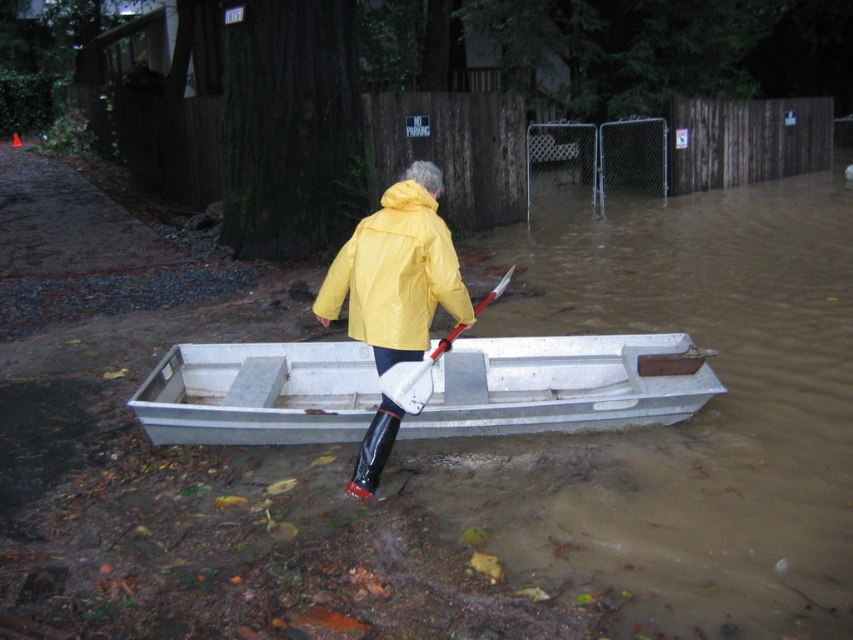
Is metallic gray boat at center bigger than white plastic paddle at center?

Yes.

Does metallic gray boat at center appear under white plastic paddle at center?

Yes, metallic gray boat at center is below white plastic paddle at center.

Who is more distant from viewer, (x=473, y=365) or (x=401, y=385)?

The point (x=473, y=365) is more distant.

Identify the location of metallic gray boat at center. The width and height of the screenshot is (853, 640). [x=561, y=385].

Can you confirm if metallic gray boat at center is positioned above yellow matte jacket at center?

Actually, metallic gray boat at center is below yellow matte jacket at center.

Is point (686, 381) in front of point (402, 332)?

No, (686, 381) is behind (402, 332).

Image resolution: width=853 pixels, height=640 pixels. I want to click on metallic gray boat at center, so click(x=561, y=385).

Is yellow matte jacket at center wider than white plastic paddle at center?

Indeed, yellow matte jacket at center has a greater width compared to white plastic paddle at center.

Who is more distant from viewer, (408, 301) or (494, 292)?

Positioned behind is point (494, 292).

You are a GUI agent. You are given a task and a screenshot of the screen. Output one action in this format:
    pyautogui.click(x=<x>, y=<y>)
    Task: Click on the yellow matte jacket at center
    The width and height of the screenshot is (853, 640).
    Given the screenshot: What is the action you would take?
    pyautogui.click(x=395, y=273)

The height and width of the screenshot is (640, 853). In order to click on yellow matte jacket at center in this screenshot , I will do `click(395, 273)`.